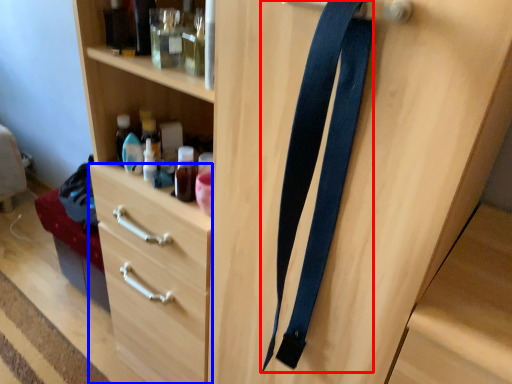
Question: Which object appears farthest to the camera in this image, suspenders (highlighted by a red box) or drawer (highlighted by a blue box)?

Choices:
 (A) suspenders
 (B) drawer

Answer: (B)